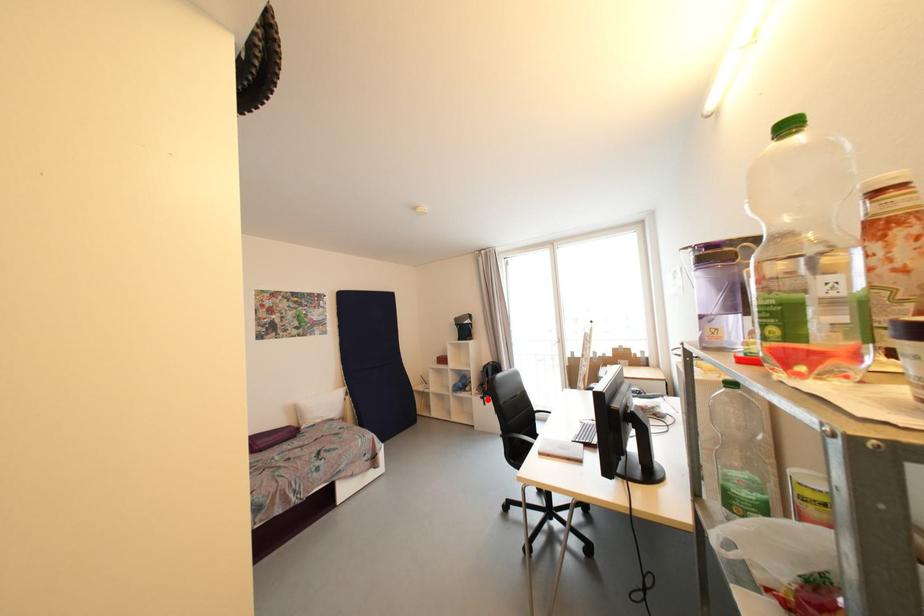
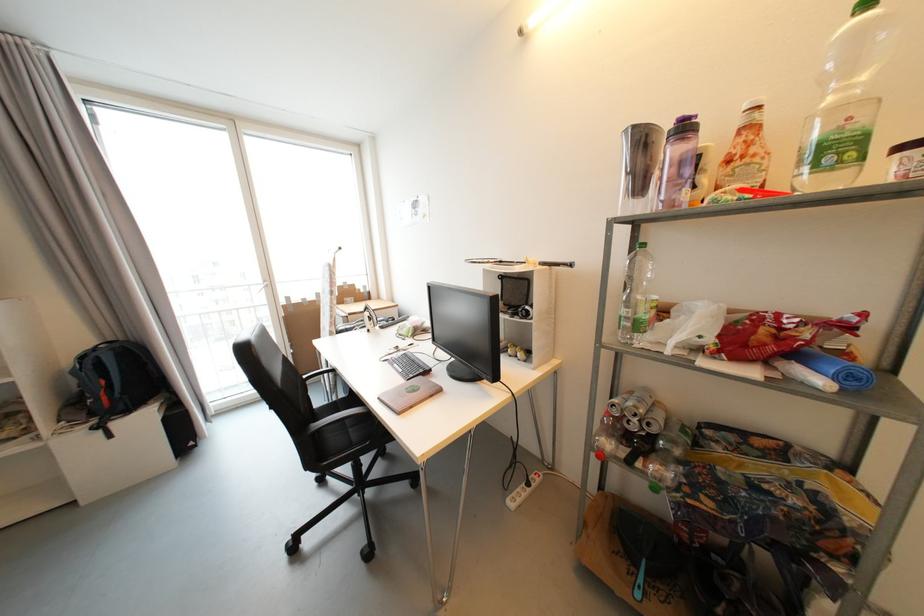
Question: I am providing you with two images of the same scene from different viewpoints. In image1, a red point is highlighted. Considering the same 3D point in image2, which of the following is correct?

Choices:
 (A) It is closer
 (B) It is farther

Answer: (A)